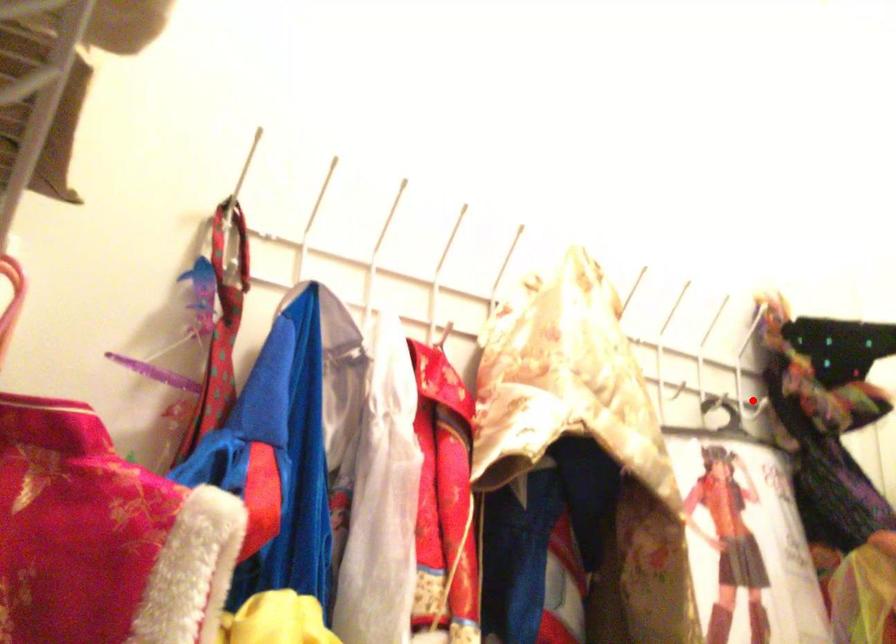
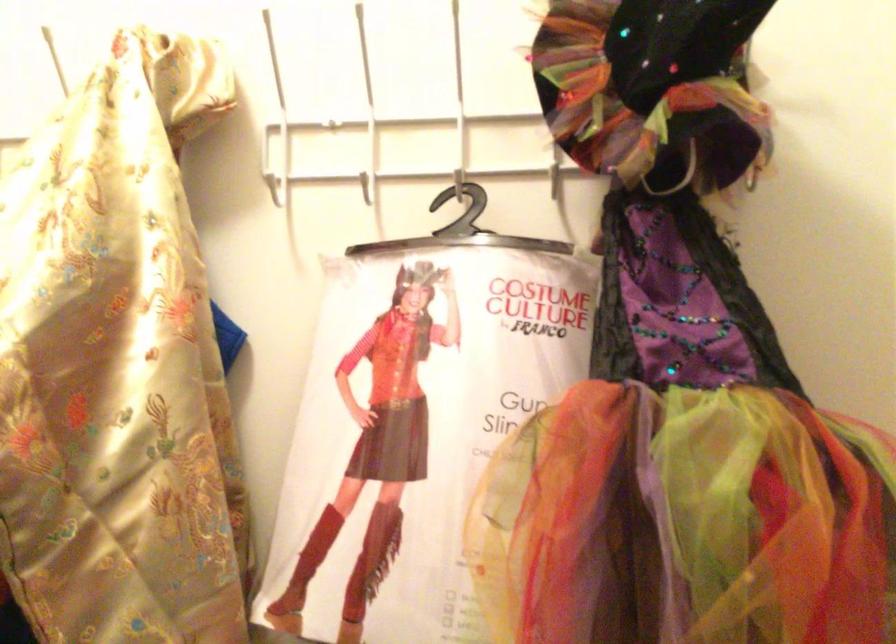
Question: I am providing you with two images of the same scene from different viewpoints. Given a red point in image1, look at the same physical point in image2. Is it:

Choices:
 (A) Closer to the viewpoint
 (B) Farther from the viewpoint

Answer: (A)